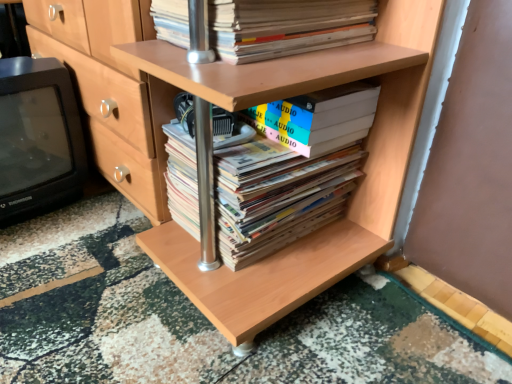
Describe the element at coordinates (288, 169) in the screenshot. The width and height of the screenshot is (512, 384). I see `hardcover books at center, which is the 3th book from top to bottom` at that location.

Describe the element at coordinates (287, 27) in the screenshot. Image resolution: width=512 pixels, height=384 pixels. I see `matte cardboard book at upper center, which is counted as the 3th book, starting from the bottom` at that location.

You are a GUI agent. You are given a task and a screenshot of the screen. Output one action in this format:
    pyautogui.click(x=<x>, y=<y>)
    Task: Click on the hardcover books at center, which is the 3th book from top to bottom
    The height and width of the screenshot is (384, 512).
    Given the screenshot: What is the action you would take?
    pyautogui.click(x=288, y=169)

Does matte cardboard book at upper center, which is counted as the 3th book, starting from the bottom, turn towards white matte book at center, the 2th book when ordered from top to bottom?

No.

Between matte cardboard book at upper center, which is counted as the 3th book, starting from the bottom, and white matte book at center, the second book from the bottom, which one is positioned behind?

Positioned behind is white matte book at center, the second book from the bottom.

From the picture: Considering the sizes of matte cardboard book at upper center, which ranks as the 1th book in top-to-bottom order, and white matte book at center, the 2th book when ordered from top to bottom, in the image, is matte cardboard book at upper center, which ranks as the 1th book in top-to-bottom order, wider or thinner than white matte book at center, the 2th book when ordered from top to bottom,?

In the image, matte cardboard book at upper center, which ranks as the 1th book in top-to-bottom order, appears to be wider than white matte book at center, the 2th book when ordered from top to bottom.

Does point (249, 4) lie behind point (366, 85)?

No, (249, 4) is closer to viewer.

Considering the sizes of objects black plastic television at left and hardcover books at center, which is the 3th book from top to bottom, in the image provided, who is taller, black plastic television at left or hardcover books at center, which is the 3th book from top to bottom,?

Standing taller between the two is black plastic television at left.

Which is in front, point (24, 175) or point (291, 221)?

The point (291, 221) is more forward.

Is black plastic television at left in contact with hardcover books at center, which is the 3th book from top to bottom?

black plastic television at left is not next to hardcover books at center, which is the 3th book from top to bottom, and they're not touching.

Is black plastic television at left not near matte cardboard book at upper center, which is counted as the 3th book, starting from the bottom?

black plastic television at left is near matte cardboard book at upper center, which is counted as the 3th book, starting from the bottom, not far away.

Who is more distant, black plastic television at left or matte cardboard book at upper center, which is counted as the 3th book, starting from the bottom?

black plastic television at left is more distant.

Would you say black plastic television at left contains matte cardboard book at upper center, which ranks as the 1th book in top-to-bottom order?

No, black plastic television at left does not contain matte cardboard book at upper center, which ranks as the 1th book in top-to-bottom order.

Considering the points (337, 101) and (312, 143), which point is in front, point (337, 101) or point (312, 143)?

Point (337, 101)

Is hardcover books at center, which is the 3th book from top to bottom, turned away from white matte book at center, the second book from the bottom?

No, hardcover books at center, which is the 3th book from top to bottom,'s orientation is not away from white matte book at center, the second book from the bottom.

Can we say hardcover books at center, the 1th book when ordered from bottom to top, lies outside white matte book at center, the second book from the bottom?

Yes, hardcover books at center, the 1th book when ordered from bottom to top, is located beyond the bounds of white matte book at center, the second book from the bottom.

Is white matte book at center, the second book from the bottom, far from hardcover books at center, which is the 3th book from top to bottom?

Actually, white matte book at center, the second book from the bottom, and hardcover books at center, which is the 3th book from top to bottom, are a little close together.

Considering the positions of objects white matte book at center, the 2th book when ordered from top to bottom, and hardcover books at center, the 1th book when ordered from bottom to top, in the image provided, who is behind, white matte book at center, the 2th book when ordered from top to bottom, or hardcover books at center, the 1th book when ordered from bottom to top,?

white matte book at center, the 2th book when ordered from top to bottom, is behind.

Which point is more forward, [358,115] or [184,161]?

The point [358,115] is in front.

Considering the positions of objects hardcover books at center, the 1th book when ordered from bottom to top, and black plastic television at left in the image provided, who is more to the left, hardcover books at center, the 1th book when ordered from bottom to top, or black plastic television at left?

black plastic television at left.

What's the angular difference between hardcover books at center, which is the 3th book from top to bottom, and black plastic television at left's facing directions?

92.3 degrees separate the facing orientations of hardcover books at center, which is the 3th book from top to bottom, and black plastic television at left.

From a real-world perspective, is hardcover books at center, which is the 3th book from top to bottom, physically above black plastic television at left?

No, from a real-world perspective, hardcover books at center, which is the 3th book from top to bottom, is not above black plastic television at left.

Could matte cardboard book at upper center, which ranks as the 1th book in top-to-bottom order, be considered to be inside white matte book at center, the second book from the bottom?

No, matte cardboard book at upper center, which ranks as the 1th book in top-to-bottom order, is located outside of white matte book at center, the second book from the bottom.

Consider the image. Can you confirm if white matte book at center, the 2th book when ordered from top to bottom, is wider than matte cardboard book at upper center, which is counted as the 3th book, starting from the bottom?

No, white matte book at center, the 2th book when ordered from top to bottom, is not wider than matte cardboard book at upper center, which is counted as the 3th book, starting from the bottom.

Which is behind, point (314, 128) or point (154, 15)?

The point (154, 15) is behind.

Considering the relative positions of white matte book at center, the 2th book when ordered from top to bottom, and matte cardboard book at upper center, which is counted as the 3th book, starting from the bottom, in the image provided, is white matte book at center, the 2th book when ordered from top to bottom, in front of matte cardboard book at upper center, which is counted as the 3th book, starting from the bottom,?

No, white matte book at center, the 2th book when ordered from top to bottom, is behind matte cardboard book at upper center, which is counted as the 3th book, starting from the bottom.

From a real-world perspective, which book is the 1st one underneath the matte cardboard book at upper center, which is counted as the 3th book, starting from the bottom? Please provide its 2D coordinates.

[(318, 118)]

I want to click on the 2nd book in front of the black plastic television at left, counting from the anchor's position, so click(x=288, y=169).

Looking at the image, which one is located closer to matte cardboard book at upper center, which ranks as the 1th book in top-to-bottom order, hardcover books at center, the 1th book when ordered from bottom to top, or white matte book at center, the second book from the bottom?

Among the two, white matte book at center, the second book from the bottom, is located nearer to matte cardboard book at upper center, which ranks as the 1th book in top-to-bottom order.

Based on the photo, estimate the real-world distances between objects in this image. Which object is closer to white matte book at center, the second book from the bottom, hardcover books at center, the 1th book when ordered from bottom to top, or black plastic television at left?

hardcover books at center, the 1th book when ordered from bottom to top.

When comparing their distances from matte cardboard book at upper center, which is counted as the 3th book, starting from the bottom, does hardcover books at center, the 1th book when ordered from bottom to top, or black plastic television at left seem further?

black plastic television at left is positioned further to the anchor matte cardboard book at upper center, which is counted as the 3th book, starting from the bottom.

Estimate the real-world distances between objects in this image. Which object is further from black plastic television at left, hardcover books at center, the 1th book when ordered from bottom to top, or matte cardboard book at upper center, which ranks as the 1th book in top-to-bottom order?

matte cardboard book at upper center, which ranks as the 1th book in top-to-bottom order.

When comparing their distances from hardcover books at center, which is the 3th book from top to bottom, does matte cardboard book at upper center, which is counted as the 3th book, starting from the bottom, or white matte book at center, the 2th book when ordered from top to bottom, seem closer?

Based on the image, white matte book at center, the 2th book when ordered from top to bottom, appears to be nearer to hardcover books at center, which is the 3th book from top to bottom.

Looking at the image, which one is located closer to hardcover books at center, the 1th book when ordered from bottom to top, black plastic television at left or white matte book at center, the second book from the bottom?

white matte book at center, the second book from the bottom, lies closer to hardcover books at center, the 1th book when ordered from bottom to top, than the other object.

Looking at the image, which one is located further to hardcover books at center, the 1th book when ordered from bottom to top, black plastic television at left or matte cardboard book at upper center, which is counted as the 3th book, starting from the bottom?

The object further to hardcover books at center, the 1th book when ordered from bottom to top, is black plastic television at left.

Looking at the image, which one is located closer to hardcover books at center, which is the 3th book from top to bottom, matte cardboard book at upper center, which ranks as the 1th book in top-to-bottom order, or black plastic television at left?

matte cardboard book at upper center, which ranks as the 1th book in top-to-bottom order, is positioned closer to the anchor hardcover books at center, which is the 3th book from top to bottom.

The height and width of the screenshot is (384, 512). Find the location of `book between black plastic television at left and matte cardboard book at upper center, which ranks as the 1th book in top-to-bottom order, in the horizontal direction`. book between black plastic television at left and matte cardboard book at upper center, which ranks as the 1th book in top-to-bottom order, in the horizontal direction is located at coordinates (288, 169).

Where is `book between matte cardboard book at upper center, which ranks as the 1th book in top-to-bottom order, and hardcover books at center, which is the 3th book from top to bottom, in the up-down direction`? The width and height of the screenshot is (512, 384). book between matte cardboard book at upper center, which ranks as the 1th book in top-to-bottom order, and hardcover books at center, which is the 3th book from top to bottom, in the up-down direction is located at coordinates (318, 118).